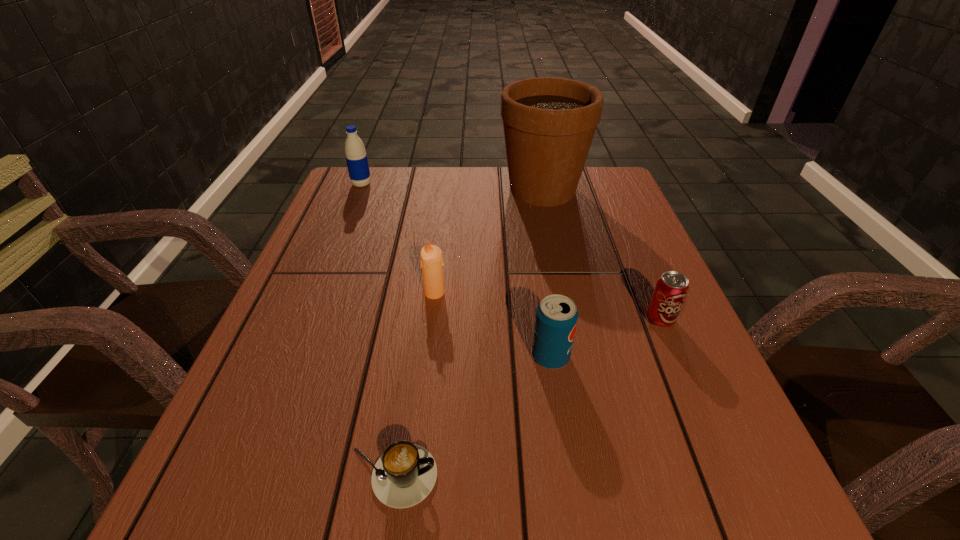
Identify the location of the tallest object. (549, 123).

Locate an element on the screen. the second tallest object is located at coordinates (355, 153).

I want to click on the leftmost object, so click(355, 153).

The width and height of the screenshot is (960, 540). What are the coordinates of `candle` in the screenshot? It's located at (431, 258).

This screenshot has height=540, width=960. What are the coordinates of `the nearer soda` in the screenshot? It's located at (556, 319).

Locate an element on the screen. This screenshot has height=540, width=960. the taller soda is located at coordinates (556, 319).

Find the location of a particular element. the second shortest object is located at coordinates (670, 292).

Find the location of a particular element. the rightmost object is located at coordinates (670, 292).

Find the location of a particular element. The height and width of the screenshot is (540, 960). the nearest object is located at coordinates [x=405, y=474].

Where is `cappuccino`? Image resolution: width=960 pixels, height=540 pixels. cappuccino is located at coordinates (405, 474).